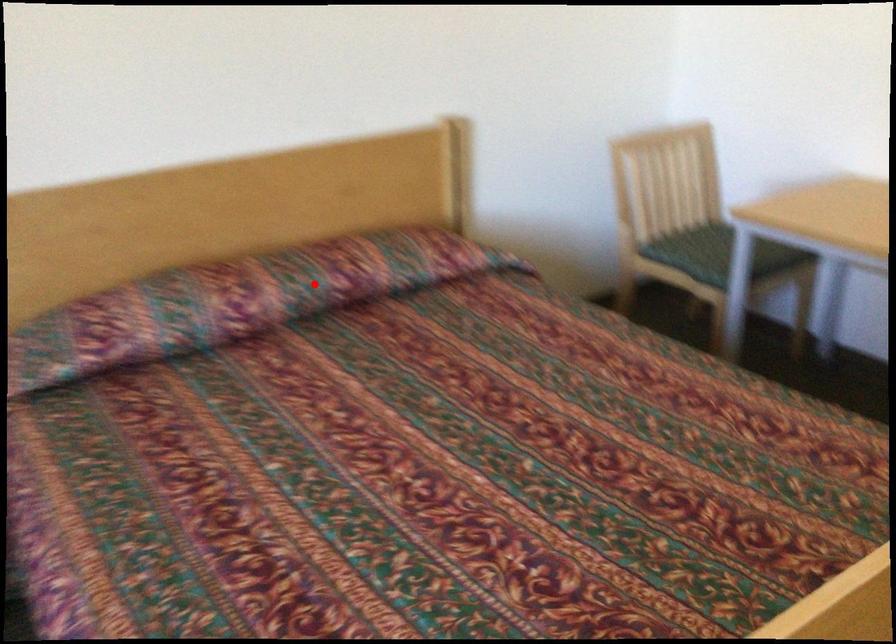
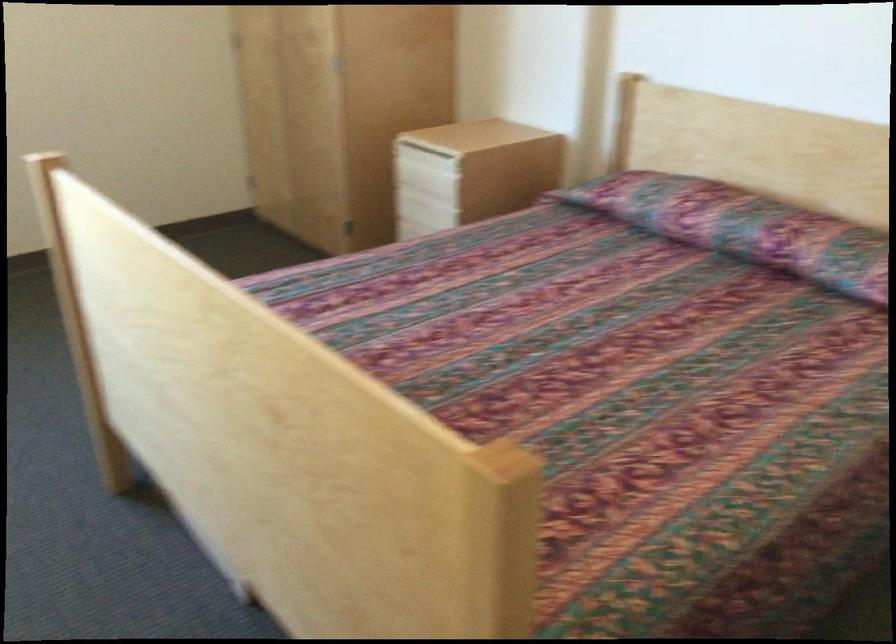
Where in the second image is the point corresponding to the highlighted location from the first image?

(744, 227)